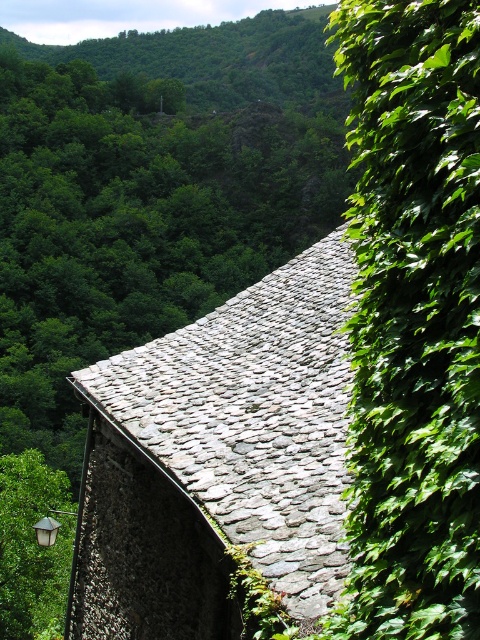
You are a painter standing at the base of the wall with the green leafy ivy at right and the gray stone roof at upper center in your view. Which object should you focus on first if you want to paint the larger one?

The gray stone roof at upper center is larger than the green leafy ivy at right, so you should focus on painting the gray stone roof at upper center first.

You are standing at the point marked by the coordinate point at (x=412, y=320). Looking around, you notice the green leafy ivy at right. Which direction should you face to see the dense growth of green ivy climbing up the wall?

You should face to the right to see the dense growth of green ivy climbing up the wall because the green leafy ivy at right is located to the right of the point marked by the coordinate point at (x=412, y=320).